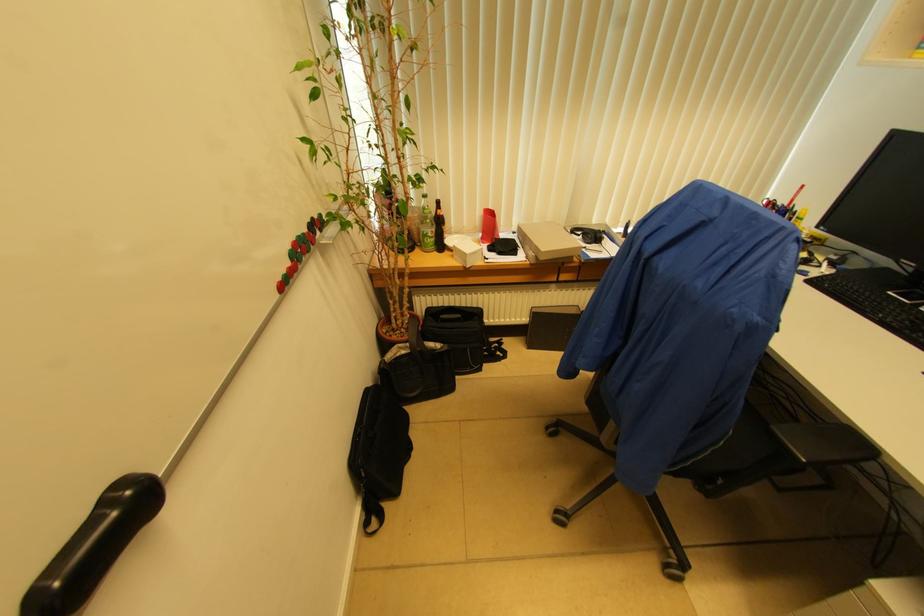
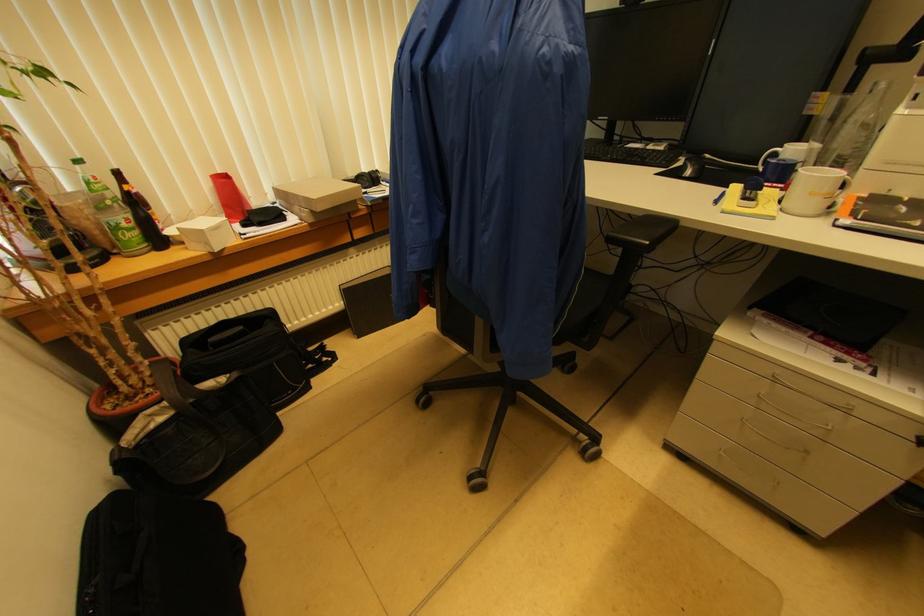
Locate, in the second image, the point that corresponds to point 467,264 in the first image.

(209, 246)